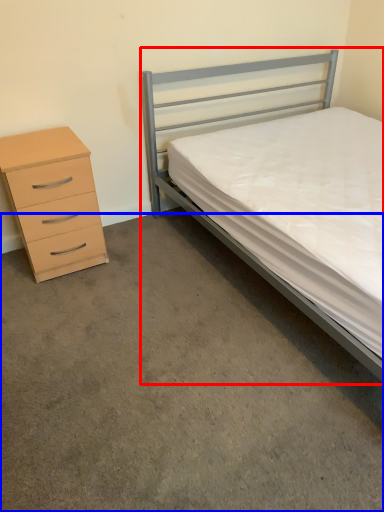
Question: Which object is further to the camera taking this photo, bed (highlighted by a red box) or concrete (highlighted by a blue box)?

Choices:
 (A) bed
 (B) concrete

Answer: (A)